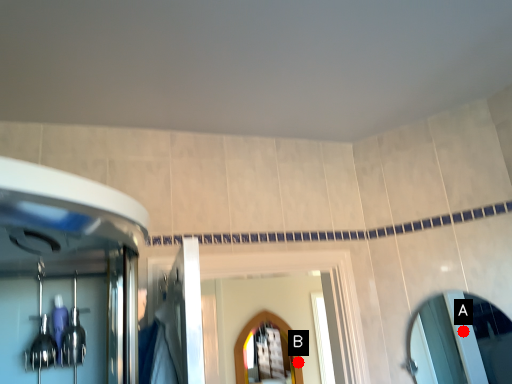
Question: Two points are circled on the image, labeled by A and B beside each circle. Which of the following is the closest to the observer?

Choices:
 (A) A is closer
 (B) B is closer

Answer: (A)